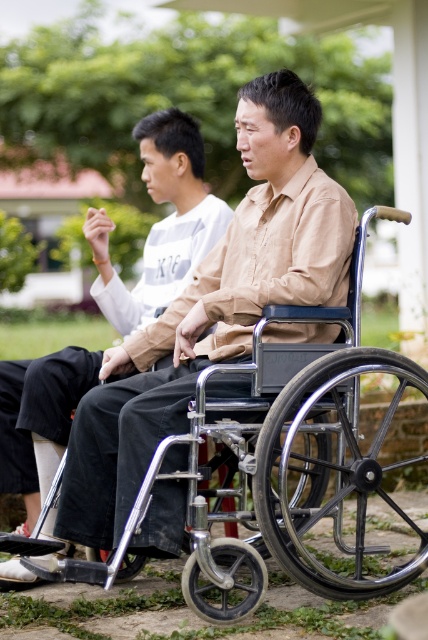
You are a park maintenance worker who needs to move the metallic silver wheelchair at center and the matte black wheelchair at center to a storage area. However, you can only lift one wheelchair at a time. Based on their positions in the image, which wheelchair would be easier to access first without moving the other?

The metallic silver wheelchair at center is positioned under the matte black wheelchair at center, so the matte black wheelchair at center is easier to access first without moving the other.

You are standing in the park and want to take a photo of both the point at (x=214, y=464) and the point at (x=145, y=305). Which point should you focus on first to ensure both are in clear view?

You should focus on point (x=214, y=464) first because it is closer to the camera than point (x=145, y=305), ensuring both points are in focus.